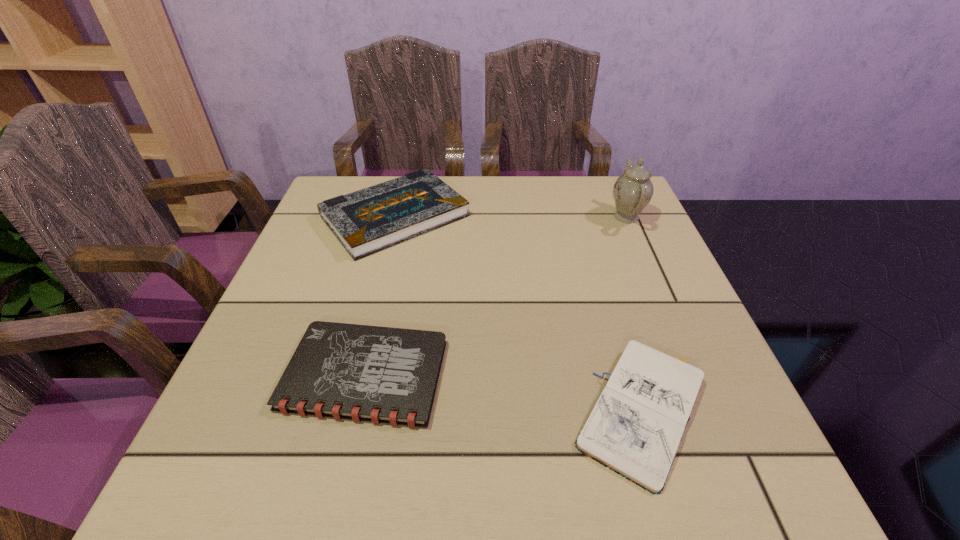
Identify the location of notebook that is at the far edge. (369, 220).

Where is `object that is positioned at the near edge`? The height and width of the screenshot is (540, 960). object that is positioned at the near edge is located at coordinates (635, 428).

Locate an element on the screen. chinaware that is at the right edge is located at coordinates pyautogui.click(x=633, y=190).

The width and height of the screenshot is (960, 540). Identify the location of notebook located in the right edge section of the desktop. (635, 428).

You are a GUI agent. You are given a task and a screenshot of the screen. Output one action in this format:
    pyautogui.click(x=<x>, y=<y>)
    Task: Click on the object that is positioned at the far left corner
    Image resolution: width=960 pixels, height=540 pixels.
    Given the screenshot: What is the action you would take?
    pyautogui.click(x=369, y=220)

Find the location of `object that is at the far right corner`. object that is at the far right corner is located at coordinates (633, 190).

In order to click on object that is at the near right corner in this screenshot , I will do `click(635, 428)`.

The width and height of the screenshot is (960, 540). Find the location of `vacant position at the far edge of the desktop`. vacant position at the far edge of the desktop is located at coordinates point(518,200).

Locate an element on the screen. This screenshot has height=540, width=960. vacant space at the near edge is located at coordinates (521, 501).

Find the location of a particular element. free location at the left edge is located at coordinates (238, 366).